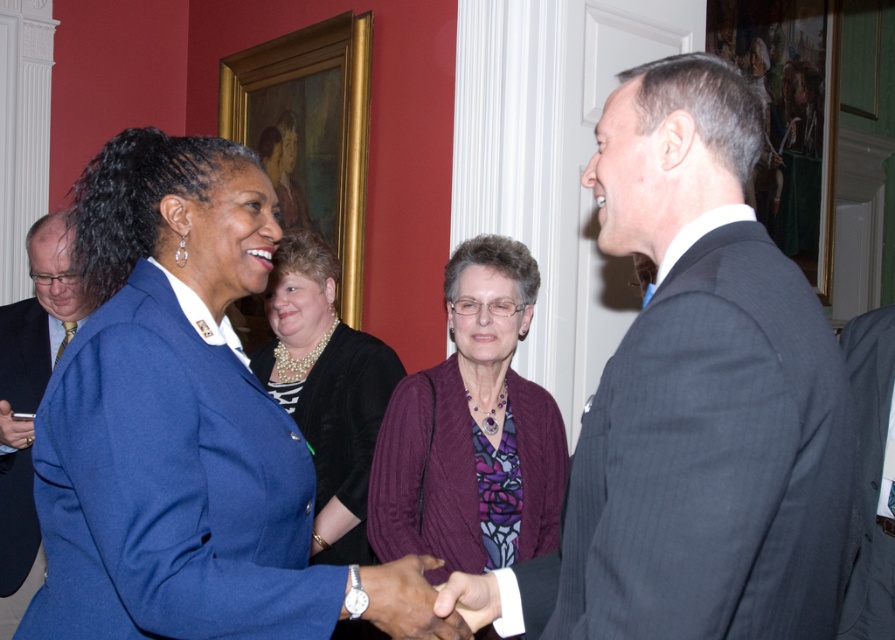
Question: Estimate the real-world distances between objects in this image. Which object is farther from the dark gray pinstripe suit at right?

Choices:
 (A) gray wool suit at right
 (B) smooth purple hand at center
 (C) matte black suit at left
 (D) purple ribbed sweater at center

Answer: (C)

Question: Which object is positioned closest to the matte blue blazer at left?

Choices:
 (A) gray wool suit at right
 (B) pearl necklace at center
 (C) purple ribbed sweater at center

Answer: (C)

Question: Does purple ribbed sweater at center have a larger size compared to matte black suit at left?

Choices:
 (A) yes
 (B) no

Answer: (B)

Question: Observing the image, what is the correct spatial positioning of pearl necklace at center in reference to smooth purple hand at center?

Choices:
 (A) left
 (B) right

Answer: (A)

Question: Which object is positioned farthest from the pearl necklace at center?

Choices:
 (A) matte black suit at left
 (B) purple ribbed sweater at center
 (C) dark gray pinstripe suit at right
 (D) smooth purple hand at center

Answer: (C)

Question: Does dark gray pinstripe suit at right have a smaller size compared to smooth purple hand at center?

Choices:
 (A) no
 (B) yes

Answer: (A)